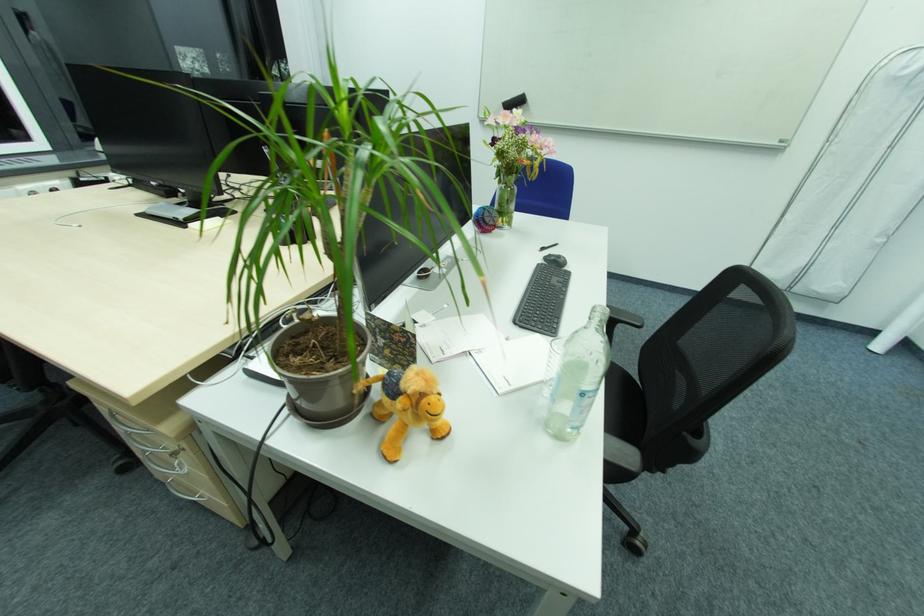
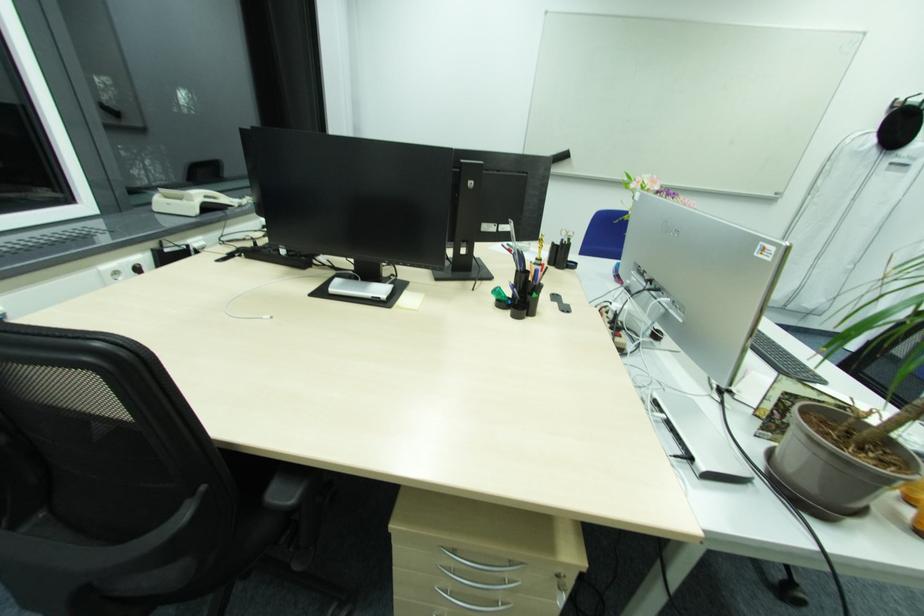
In the second image, find the point that corresponds to pixel 41 193 in the first image.

(120, 272)